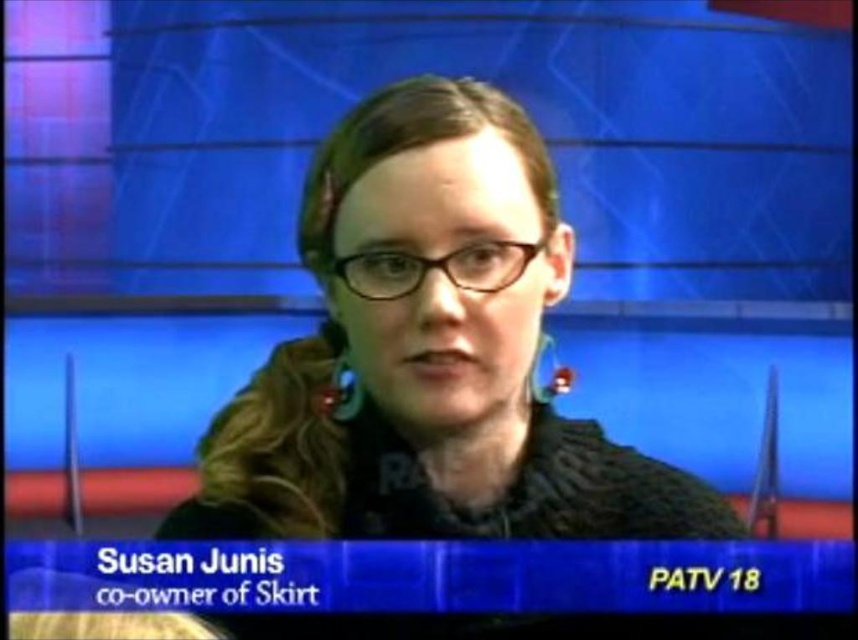
Looking at this image, between matte black glasses at center and green fabric earring at center, which one is positioned lower?

matte black glasses at center

Which is behind, point (166, 534) or point (553, 340)?

The point (553, 340) is behind.

The image size is (858, 640). Find the location of `matte black glasses at center`. matte black glasses at center is located at coordinates [430, 353].

Where is `black plastic glasses at center`? This screenshot has width=858, height=640. black plastic glasses at center is located at coordinates (434, 268).

I want to click on black plastic glasses at center, so click(434, 268).

The width and height of the screenshot is (858, 640). Find the location of `black plastic glasses at center`. black plastic glasses at center is located at coordinates (434, 268).

Between matte black glasses at center and black plastic glasses at center, which one is positioned lower?

matte black glasses at center

Between point (486, 356) and point (498, 273), which one is positioned behind?

Point (486, 356)

You are a GUI agent. You are given a task and a screenshot of the screen. Output one action in this format:
    pyautogui.click(x=<x>, y=<y>)
    Task: Click on the matte black glasses at center
    
    Given the screenshot: What is the action you would take?
    coord(430,353)

Image resolution: width=858 pixels, height=640 pixels. Identify the location of matte black glasses at center. (430, 353).